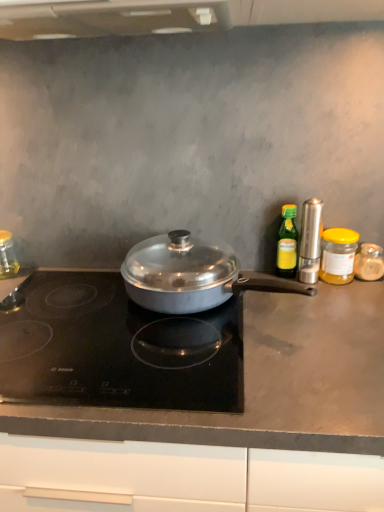
You are a GUI agent. You are given a task and a screenshot of the screen. Output one action in this format:
    pyautogui.click(x=<x>, y=<y>)
    Task: Click on the vacant space in between satin silver pan at center, which ranks as the fifth kitchen appliance in right-to-left order, and clear glass jar at left, the sixth kitchen appliance in the right-to-left sequence
    The image size is (384, 512).
    Given the screenshot: What is the action you would take?
    pyautogui.click(x=58, y=289)